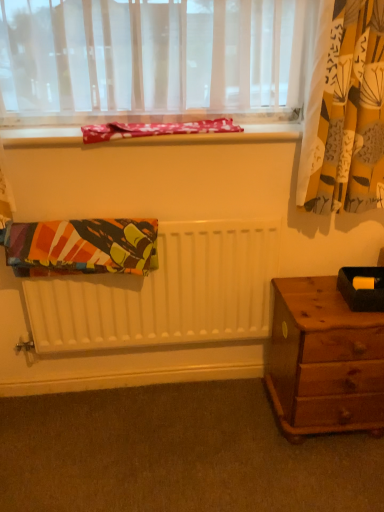
Where is `free region under multicolored fabric at center, acting as the first blanket starting from the bottom (from a real-world perspective)`? The width and height of the screenshot is (384, 512). free region under multicolored fabric at center, acting as the first blanket starting from the bottom (from a real-world perspective) is located at coordinates (92, 402).